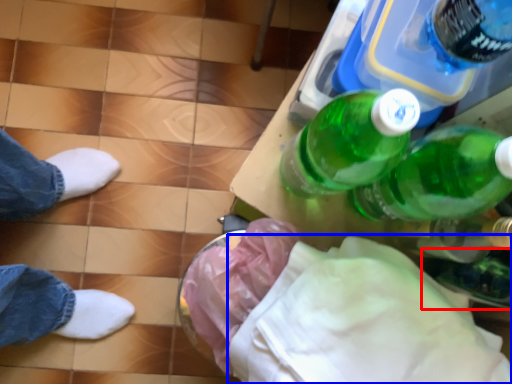
Question: Which object appears closest to the camera in this image, glass bottle (highlighted by a red box) or cloth (highlighted by a blue box)?

Choices:
 (A) glass bottle
 (B) cloth

Answer: (B)